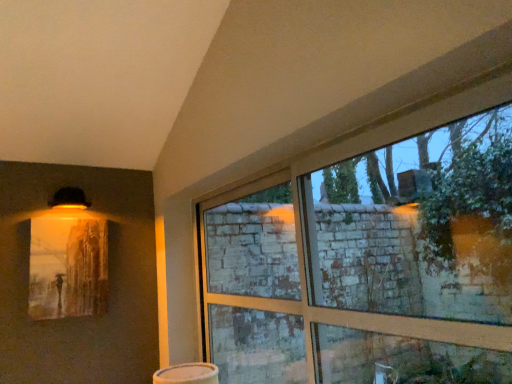
I want to click on clear glass window at right, so click(369, 265).

In order to face clear glass window at right, should I rotate leftwards or rightwards?

You should look right and rotate roughly 3.297 degrees.

Describe the element at coordinates (369, 265) in the screenshot. I see `clear glass window at right` at that location.

Locate an element on the screen. This screenshot has height=384, width=512. clear glass window at right is located at coordinates (369, 265).